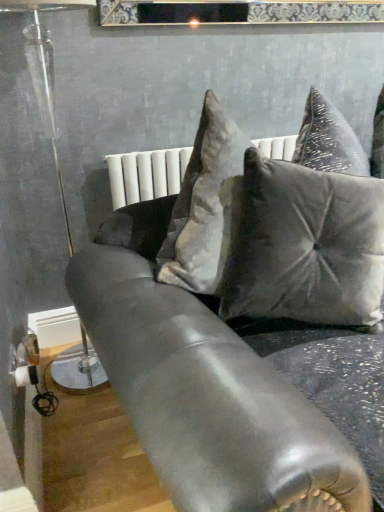
Question: Is the depth of satin gray pillow at center greater than that of satin black couch at center?

Choices:
 (A) yes
 (B) no

Answer: (A)

Question: Can you confirm if satin gray pillow at center is taller than satin black couch at center?

Choices:
 (A) no
 (B) yes

Answer: (A)

Question: From the image's perspective, would you say satin gray pillow at center is shown under satin black couch at center?

Choices:
 (A) yes
 (B) no

Answer: (B)

Question: Is satin gray pillow at center facing away from satin black couch at center?

Choices:
 (A) yes
 (B) no

Answer: (A)

Question: Does satin gray pillow at center have a lesser height compared to satin black couch at center?

Choices:
 (A) yes
 (B) no

Answer: (A)

Question: Is satin gray pillow at center aimed at satin black couch at center?

Choices:
 (A) no
 (B) yes

Answer: (B)

Question: From the image's perspective, is satin gray pillow at center located beneath clear glass lamp at left?

Choices:
 (A) no
 (B) yes

Answer: (B)

Question: Considering the relative sizes of satin gray pillow at center and clear glass lamp at left in the image provided, is satin gray pillow at center taller than clear glass lamp at left?

Choices:
 (A) yes
 (B) no

Answer: (B)

Question: Is satin gray pillow at center not inside clear glass lamp at left?

Choices:
 (A) no
 (B) yes

Answer: (B)

Question: Is the depth of satin gray pillow at center greater than that of clear glass lamp at left?

Choices:
 (A) no
 (B) yes

Answer: (A)

Question: Considering the relative positions of satin gray pillow at center and clear glass lamp at left in the image provided, is satin gray pillow at center to the left of clear glass lamp at left from the viewer's perspective?

Choices:
 (A) no
 (B) yes

Answer: (A)

Question: Could you tell me if satin gray pillow at center is turned towards clear glass lamp at left?

Choices:
 (A) yes
 (B) no

Answer: (B)

Question: Does clear glass lamp at left lie behind satin gray pillow at center?

Choices:
 (A) no
 (B) yes

Answer: (B)